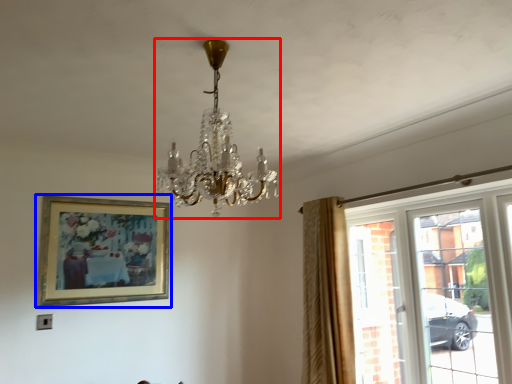
Question: Which point is further to the camera, lamp (highlighted by a red box) or picture frame (highlighted by a blue box)?

Choices:
 (A) lamp
 (B) picture frame

Answer: (B)